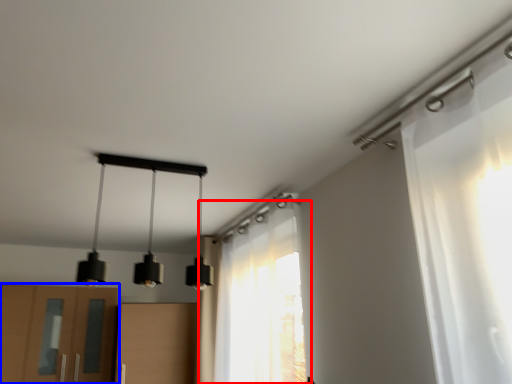
Question: Which point is closer to the camera, curtain (highlighted by a red box) or cabinetry (highlighted by a blue box)?

Choices:
 (A) curtain
 (B) cabinetry

Answer: (A)